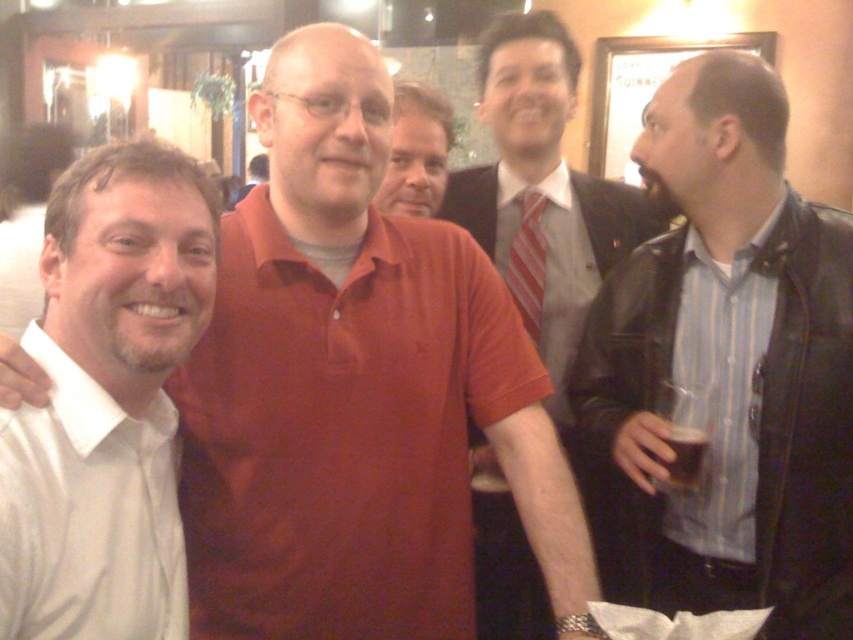
Question: Does white satin shirt at left appear over striped fabric tie at center?

Choices:
 (A) no
 (B) yes

Answer: (A)

Question: Which point is closer to the camera taking this photo?

Choices:
 (A) (115, 563)
 (B) (532, 282)

Answer: (A)

Question: Does white satin shirt at left appear on the right side of smooth red shirt at center?

Choices:
 (A) yes
 (B) no

Answer: (B)

Question: Which of the following is the closest to the observer?

Choices:
 (A) (677, 451)
 (B) (511, 106)

Answer: (A)

Question: Does leather jacket at right have a greater width compared to striped fabric tie at center?

Choices:
 (A) no
 (B) yes

Answer: (B)

Question: Estimate the real-world distances between objects in this image. Which object is closer to the leather jacket at right?

Choices:
 (A) smooth red shirt at center
 (B) matte red shirt at center
 (C) matte red polo shirt at center
 (D) striped fabric tie at center

Answer: (B)